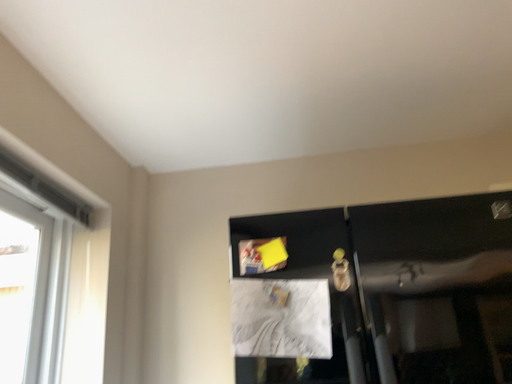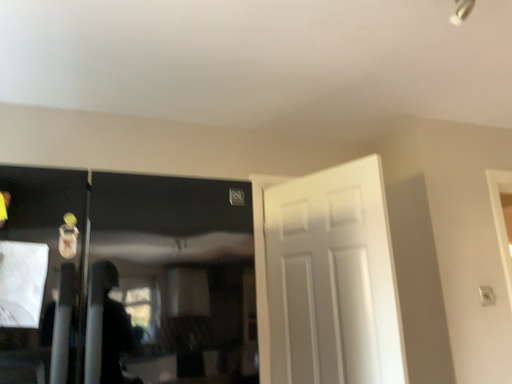
Question: How did the camera likely rotate when shooting the video?

Choices:
 (A) rotated right
 (B) rotated left

Answer: (A)